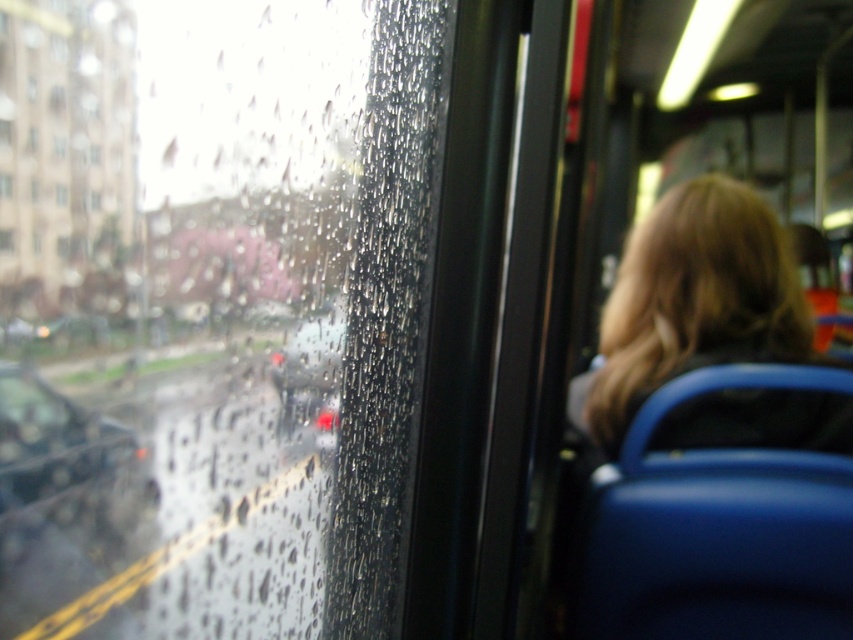
Question: Which object is the farthest from the shiny black car at center?

Choices:
 (A) transparent glass window at left
 (B) metallic gray car at left
 (C) blonde hair at right

Answer: (C)

Question: Considering the relative positions of blonde hair at right and shiny black car at center in the image provided, where is blonde hair at right located with respect to shiny black car at center?

Choices:
 (A) right
 (B) left

Answer: (A)

Question: Can you confirm if metallic gray car at left is smaller than transparent glass window at left?

Choices:
 (A) yes
 (B) no

Answer: (B)

Question: Which is farther from the shiny black car at center?

Choices:
 (A) transparent glass window at left
 (B) metallic gray car at left
 (C) blonde hair at right

Answer: (C)

Question: Which point is closer to the camera?

Choices:
 (A) shiny black car at center
 (B) blonde hair at right
 (C) metallic gray car at left

Answer: (C)

Question: Can you confirm if shiny black car at center is smaller than transparent glass window at left?

Choices:
 (A) yes
 (B) no

Answer: (B)